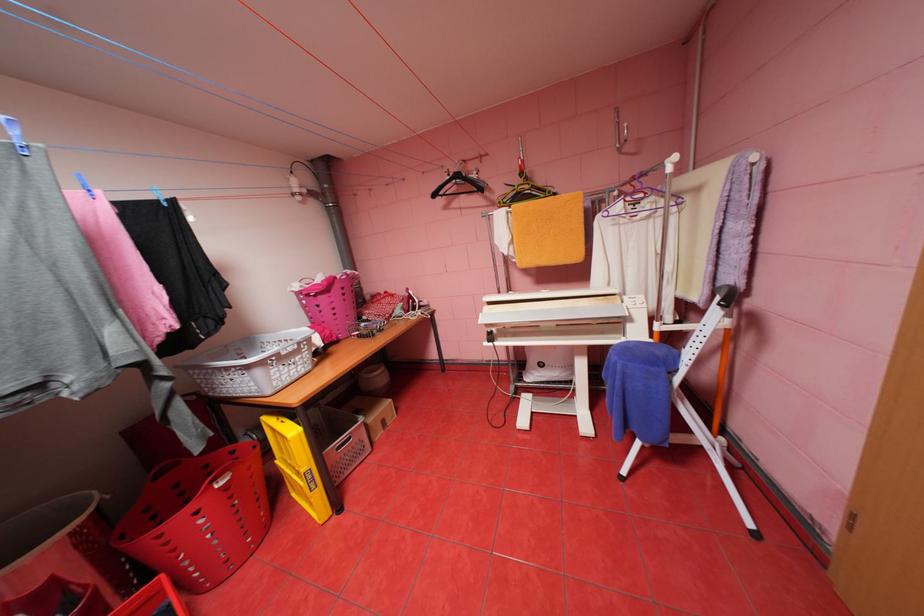
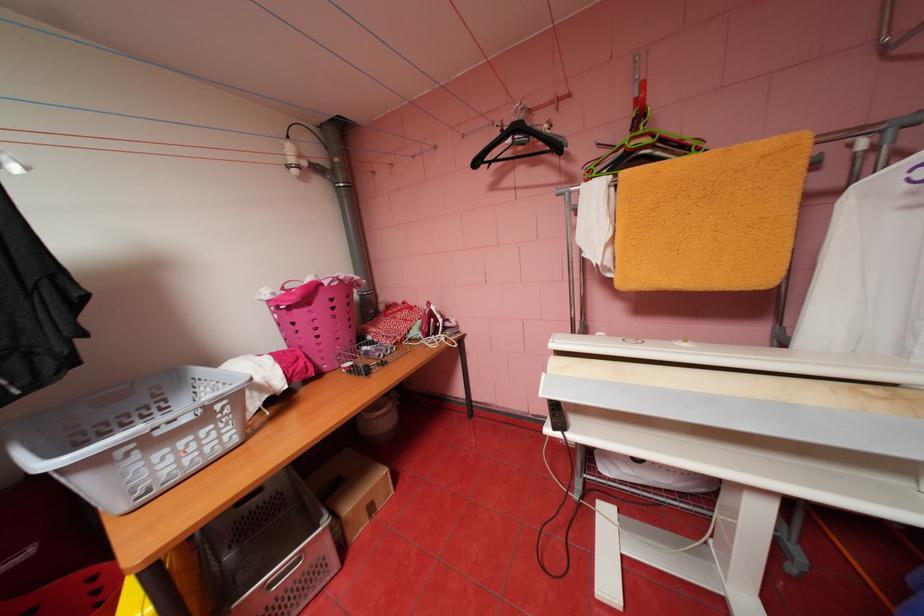
The point at (535, 187) is marked in the first image. Where is the corresponding point in the second image?

(655, 140)